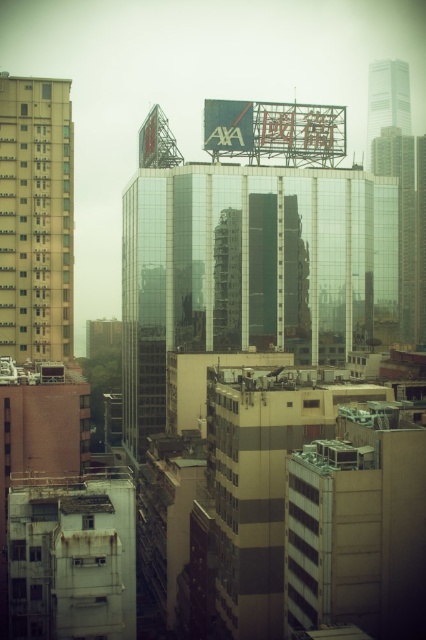
Which is below, beige concrete building at left or transparent glass skyscraper at center?

beige concrete building at left is lower down.

Which is in front, point (48, 122) or point (409, 168)?

Point (48, 122)

This screenshot has height=640, width=426. What do you see at coordinates (36, 218) in the screenshot?
I see `beige concrete building at left` at bounding box center [36, 218].

The width and height of the screenshot is (426, 640). Find the location of `beige concrete building at left`. beige concrete building at left is located at coordinates (36, 218).

The height and width of the screenshot is (640, 426). Describe the element at coordinates (406, 221) in the screenshot. I see `transparent glass skyscraper at center` at that location.

Is transparent glass skyscraper at center thinner than glass skyscraper at upper right?

Incorrect, transparent glass skyscraper at center's width is not less than glass skyscraper at upper right's.

Locate an element on the screen. This screenshot has width=426, height=640. transparent glass skyscraper at center is located at coordinates (406, 221).

Consider the image. Can you confirm if beige concrete building at left is taller than glass skyscraper at upper right?

Indeed, beige concrete building at left has a greater height compared to glass skyscraper at upper right.

How far apart are beige concrete building at left and glass skyscraper at upper right?

205.63 meters

At what (x,y) coordinates should I click in order to perform the action: click on beige concrete building at left. Please return your answer as a coordinate pair (x, y). This screenshot has height=640, width=426. Looking at the image, I should click on (36, 218).